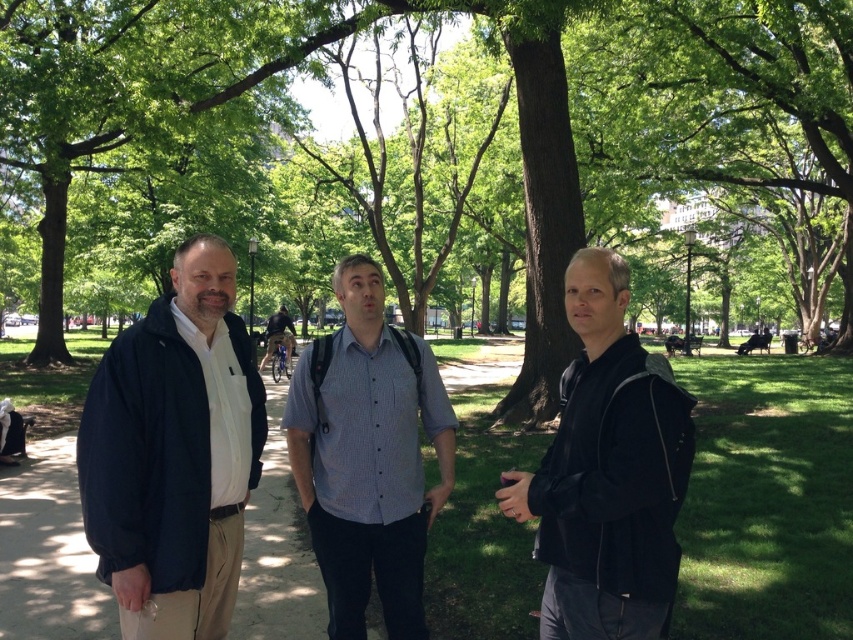
You are a photographer trying to capture a group photo of the black matte jacket at center and the blue striped shirt at center. Since you want both subjects to appear equally sized in the photo, which subject should you move closer to the camera?

The black matte jacket at center is smaller in real size compared to the blue striped shirt at center. To make them appear the same size in the photo, move the smaller black matte jacket at center closer to the camera while keeping the larger blue striped shirt at center farther back.

You are a photographer trying to capture a group photo of the black matte jacket at center and the blue striped shirt at center. You want to ensure both individuals are fully visible in the frame. Which person should you position closer to the camera to avoid cropping either of them?

Since the black matte jacket at center is narrower than the blue striped shirt at center, you should position the blue striped shirt at center closer to the camera to ensure both fit within the frame without cropping.

You are standing on the paved pathway in the park and want to walk towards the point that is closer to you. Which point should you head towards, point (581, 404) or point (387, 380)?

You should head towards point (581, 404) because it is closer to the viewer than point (387, 380).